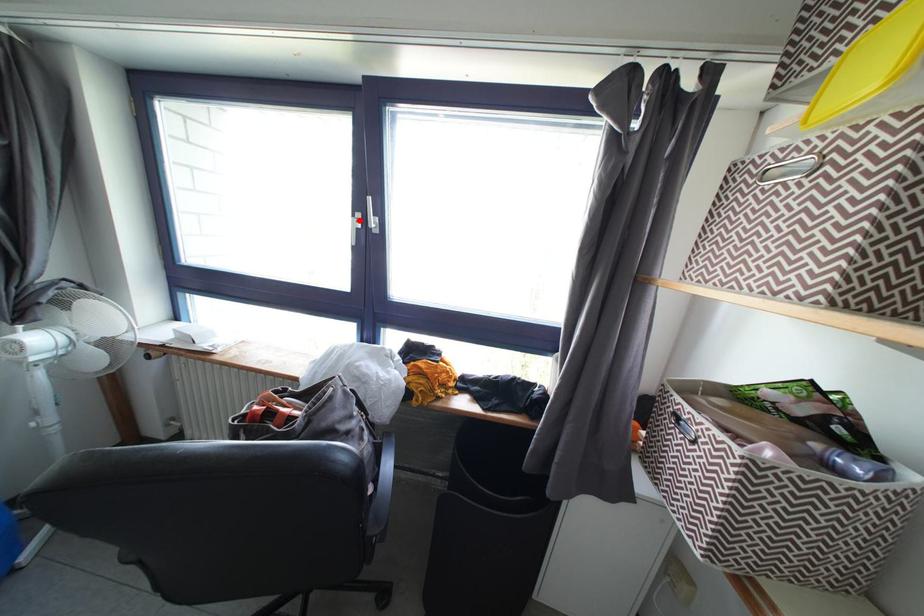
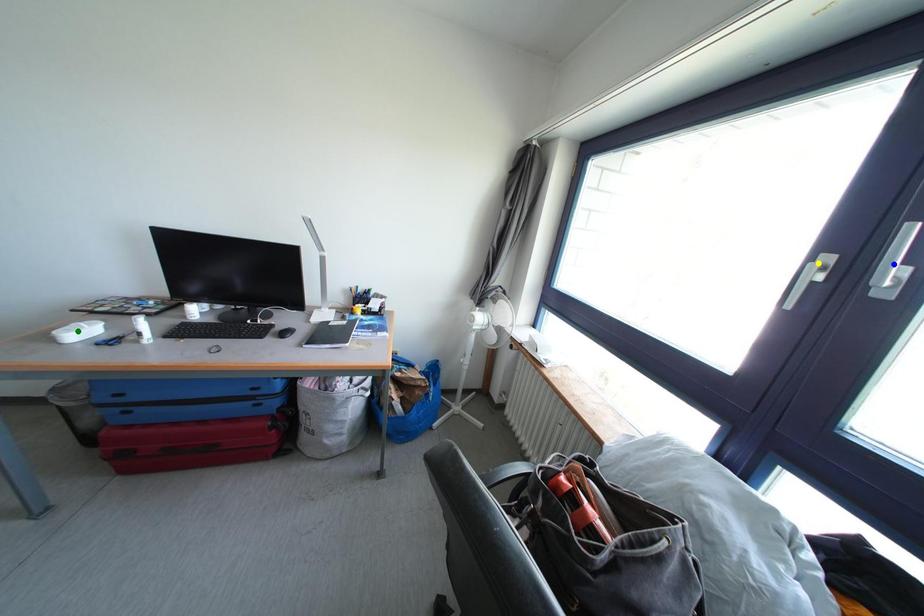
Question: I am providing you with two images of the same scene from different viewpoints. A red point is marked on the first image. You are given multiple points on the second image. Can you choose the point in image 2 that corresponds to the point in image 1?

Choices:
 (A) green point
 (B) blue point
 (C) yellow point

Answer: (C)